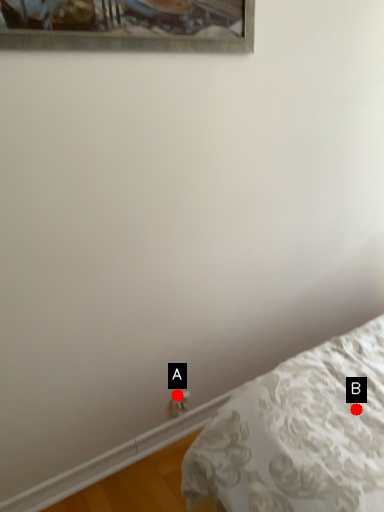
Question: Two points are circled on the image, labeled by A and B beside each circle. Among these points, which one is farthest from the camera?

Choices:
 (A) A is further
 (B) B is further

Answer: (A)